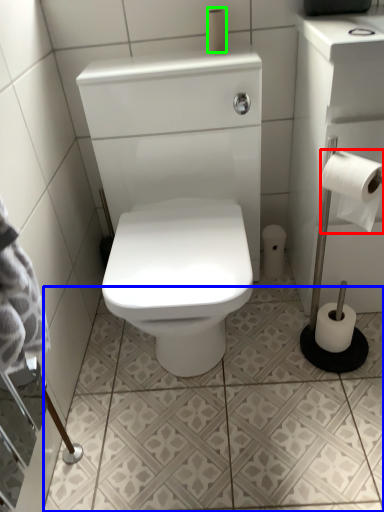
Question: Which object is positioned closest to toilet paper (highlighted by a red box)? Select from ceramic tile (highlighted by a blue box) and toilet paper (highlighted by a green box).

Choices:
 (A) ceramic tile
 (B) toilet paper

Answer: (B)